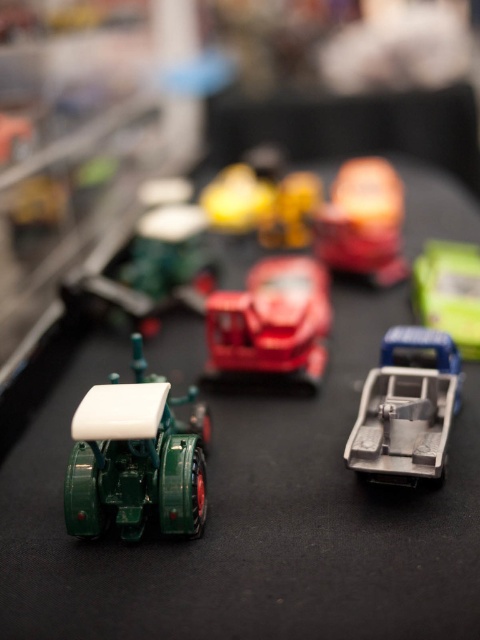
Question: Based on their relative distances, which object is farther from the glossy plastic toy car at center?

Choices:
 (A) matte orange toy at center
 (B) shiny yellow toy at center

Answer: (B)

Question: Is gray metallic truck at right further to camera compared to glossy plastic toy car at center?

Choices:
 (A) no
 (B) yes

Answer: (A)

Question: Estimate the real-world distances between objects in this image. Which object is farther from the glossy plastic toy car at center?

Choices:
 (A) green matte tractor at left
 (B) shiny yellow toy at center
 (C) matte orange toy at center

Answer: (B)

Question: Does gray metallic truck at right lie in front of glossy plastic toy car at center?

Choices:
 (A) no
 (B) yes

Answer: (B)

Question: Which object is the closest to the green matte truck at upper right?

Choices:
 (A) matte orange toy at center
 (B) glossy plastic toy car at center
 (C) green matte tractor at left
 (D) shiny yellow toy at center

Answer: (A)

Question: Can you confirm if green matte tractor at left is positioned to the left of green matte truck at upper right?

Choices:
 (A) no
 (B) yes

Answer: (B)